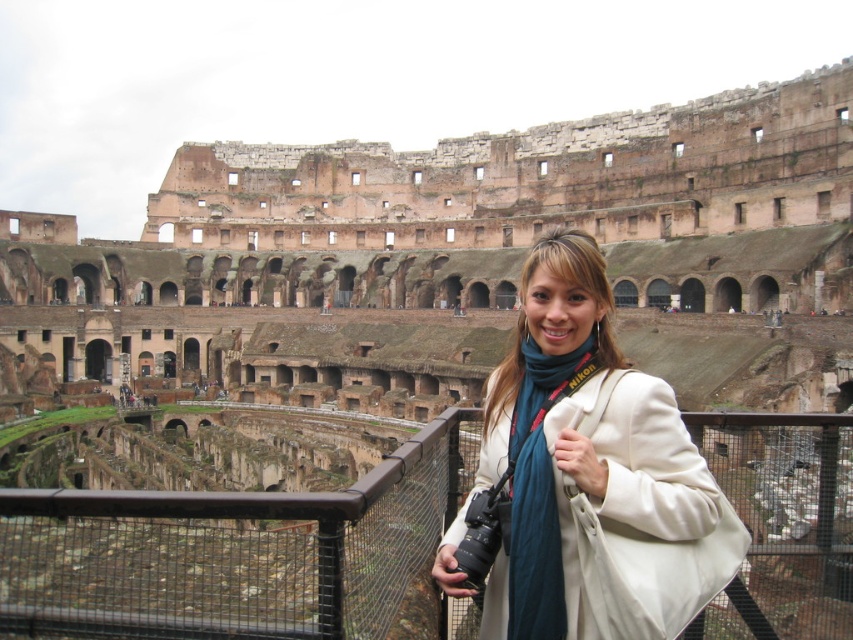
Question: Is black metal fence at lower center wider than white fabric jacket at center?

Choices:
 (A) no
 (B) yes

Answer: (B)

Question: Is white fabric jacket at center to the left of white fabric at center from the viewer's perspective?

Choices:
 (A) no
 (B) yes

Answer: (B)

Question: Estimate the real-world distances between objects in this image. Which object is farther from the white fabric at center?

Choices:
 (A) white fabric jacket at center
 (B) black metal fence at lower center

Answer: (B)

Question: Can you confirm if black metal fence at lower center is positioned to the left of white fabric at center?

Choices:
 (A) yes
 (B) no

Answer: (A)

Question: Which object is closer to the camera taking this photo?

Choices:
 (A) white fabric at center
 (B) black metal fence at lower center

Answer: (B)

Question: Which point is farther to the camera?

Choices:
 (A) white fabric at center
 (B) white fabric jacket at center
 (C) black metal fence at lower center

Answer: (A)